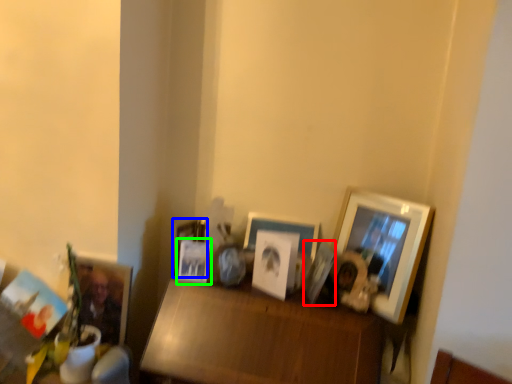
Question: Which is nearer to the picture frame (highlighted by a red box)? picture frame (highlighted by a blue box) or picture frame (highlighted by a green box).

Choices:
 (A) picture frame
 (B) picture frame

Answer: (B)